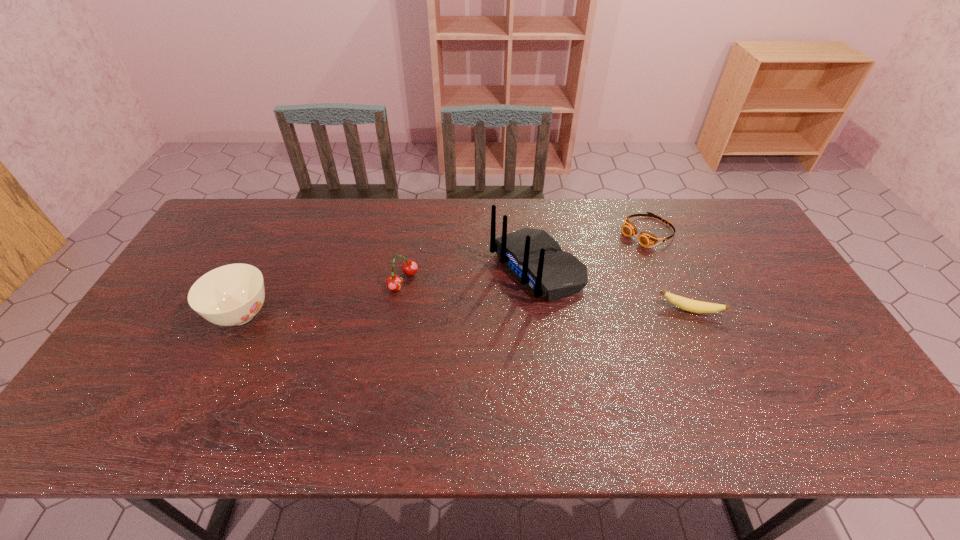
Identify the location of free region at the far edge of the desktop. The height and width of the screenshot is (540, 960). (612, 226).

Locate an element on the screen. The height and width of the screenshot is (540, 960). vacant space at the near edge is located at coordinates (688, 382).

You are a GUI agent. You are given a task and a screenshot of the screen. Output one action in this format:
    pyautogui.click(x=<x>, y=<y>)
    Task: Click on the vacant region at the left edge
    
    Given the screenshot: What is the action you would take?
    pyautogui.click(x=220, y=244)

In the image, there is a desktop. Where is `vacant space at the right edge`? vacant space at the right edge is located at coordinates (783, 329).

Where is `unoccupied position between the tallest object and the sugar bowl`? unoccupied position between the tallest object and the sugar bowl is located at coordinates (389, 292).

Identify the location of vacant space that is in between the tallest object and the sugar bowl. (389, 292).

Locate an element on the screen. free area in between the cherry and the tallest object is located at coordinates (469, 274).

You are a GUI agent. You are given a task and a screenshot of the screen. Output one action in this format:
    pyautogui.click(x=<x>, y=<y>)
    Task: Click on the vacant space in between the banana and the goggles
    The width and height of the screenshot is (960, 540).
    Given the screenshot: What is the action you would take?
    pyautogui.click(x=668, y=271)

The width and height of the screenshot is (960, 540). Find the location of `blank region between the leftmost object and the goggles`. blank region between the leftmost object and the goggles is located at coordinates click(444, 273).

Identify the location of free space between the goggles and the banana. This screenshot has height=540, width=960. pos(668,271).